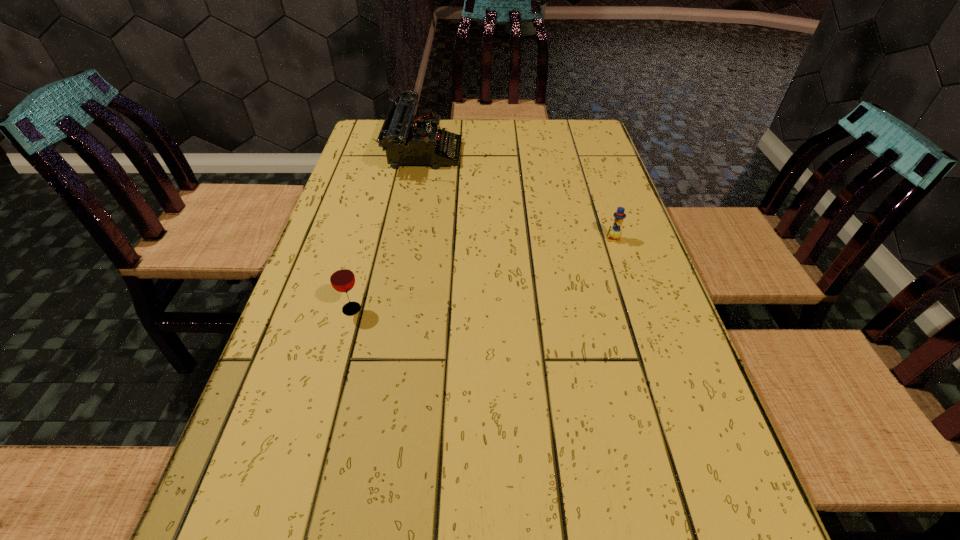
This screenshot has width=960, height=540. I want to click on glass located at the left edge, so click(x=342, y=278).

Where is `object that is positioned at the right edge`? object that is positioned at the right edge is located at coordinates (615, 232).

Identify the location of object that is positioned at the far left corner. (408, 139).

Image resolution: width=960 pixels, height=540 pixels. Identify the location of vacant space at the far edge of the desktop. (481, 144).

Where is `vacant space at the left edge of the desktop`? The width and height of the screenshot is (960, 540). vacant space at the left edge of the desktop is located at coordinates (329, 239).

In the image, there is a desktop. Where is `vacant space at the right edge`? This screenshot has height=540, width=960. vacant space at the right edge is located at coordinates (664, 525).

Image resolution: width=960 pixels, height=540 pixels. In the image, there is a desktop. What are the coordinates of `free space at the far right corner` in the screenshot? It's located at (583, 150).

You are a GUI agent. You are given a task and a screenshot of the screen. Output one action in this format:
    pyautogui.click(x=<x>, y=<y>)
    Task: Click on the empty space between the duckling and the farthest object
    The height and width of the screenshot is (540, 960).
    Given the screenshot: What is the action you would take?
    pyautogui.click(x=518, y=195)

Where is `vacant space that is in between the nearest object and the shortest object`? vacant space that is in between the nearest object and the shortest object is located at coordinates (482, 274).

I want to click on unoccupied area between the duckling and the second tallest object, so click(482, 274).